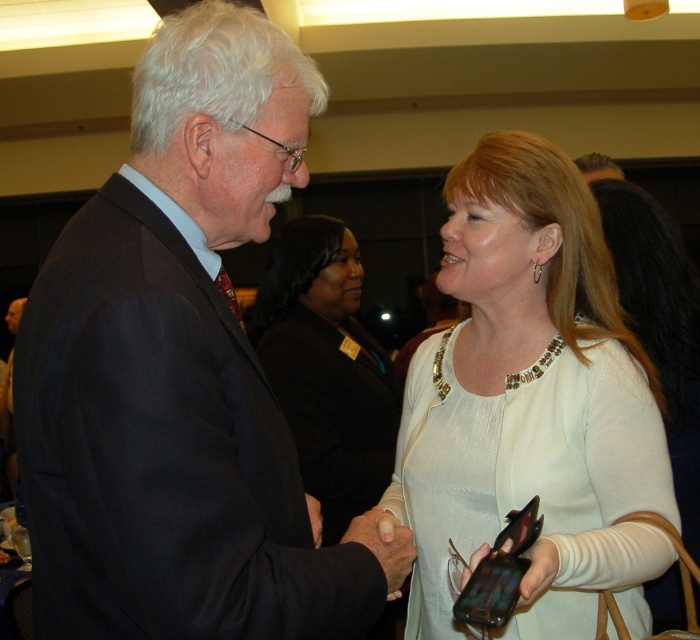
You are organizing a photo shoot and need to place a prop at the coordinates given for the dark blue suit at center. What are the coordinates where you should place the prop?

The coordinates for the dark blue suit at center are (182, 372), so you should place the prop at those coordinates.